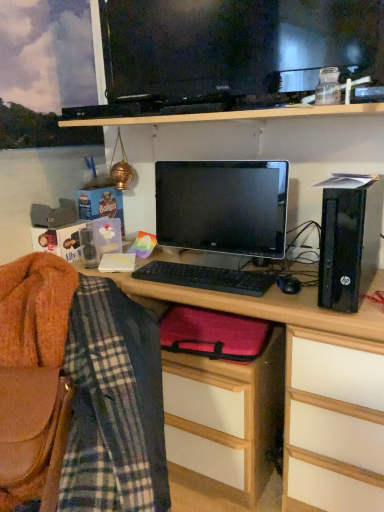
Question: Could you tell me if black plastic computer tower at right is turned towards black plastic mouse at center?

Choices:
 (A) no
 (B) yes

Answer: (A)

Question: Is black plastic computer tower at right located outside black plastic mouse at center?

Choices:
 (A) yes
 (B) no

Answer: (A)

Question: Is black plastic mouse at center a part of black plastic computer tower at right?

Choices:
 (A) yes
 (B) no

Answer: (B)

Question: From a real-world perspective, is black plastic computer tower at right beneath black plastic mouse at center?

Choices:
 (A) no
 (B) yes

Answer: (A)

Question: Can you confirm if black plastic computer tower at right is shorter than black plastic mouse at center?

Choices:
 (A) no
 (B) yes

Answer: (A)

Question: Looking at their shapes, would you say black plastic computer tower at right is wider or thinner than satin black monitor at center?

Choices:
 (A) thin
 (B) wide

Answer: (B)

Question: Based on their sizes in the image, would you say black plastic computer tower at right is bigger or smaller than satin black monitor at center?

Choices:
 (A) small
 (B) big

Answer: (B)

Question: Considering the positions of point tap(365, 202) and point tap(254, 179), is point tap(365, 202) closer or farther from the camera than point tap(254, 179)?

Choices:
 (A) closer
 (B) farther

Answer: (A)

Question: In the image, is black plastic computer tower at right positioned in front of or behind satin black monitor at center?

Choices:
 (A) behind
 (B) front

Answer: (B)

Question: Based on their sizes in the image, would you say black matte keyboard at center is bigger or smaller than black plastic computer tower at right?

Choices:
 (A) big
 (B) small

Answer: (B)

Question: In terms of width, does black matte keyboard at center look wider or thinner when compared to black plastic computer tower at right?

Choices:
 (A) thin
 (B) wide

Answer: (A)

Question: Based on their positions, is black matte keyboard at center located to the left or right of black plastic computer tower at right?

Choices:
 (A) right
 (B) left

Answer: (B)

Question: Considering the positions of black matte keyboard at center and black plastic computer tower at right in the image, is black matte keyboard at center taller or shorter than black plastic computer tower at right?

Choices:
 (A) short
 (B) tall

Answer: (A)

Question: From a real-world perspective, is matte red laptop case at lower center positioned above or below black plastic computer tower at right?

Choices:
 (A) below
 (B) above

Answer: (A)

Question: Is matte red laptop case at lower center inside the boundaries of black plastic computer tower at right, or outside?

Choices:
 (A) inside
 (B) outside

Answer: (B)